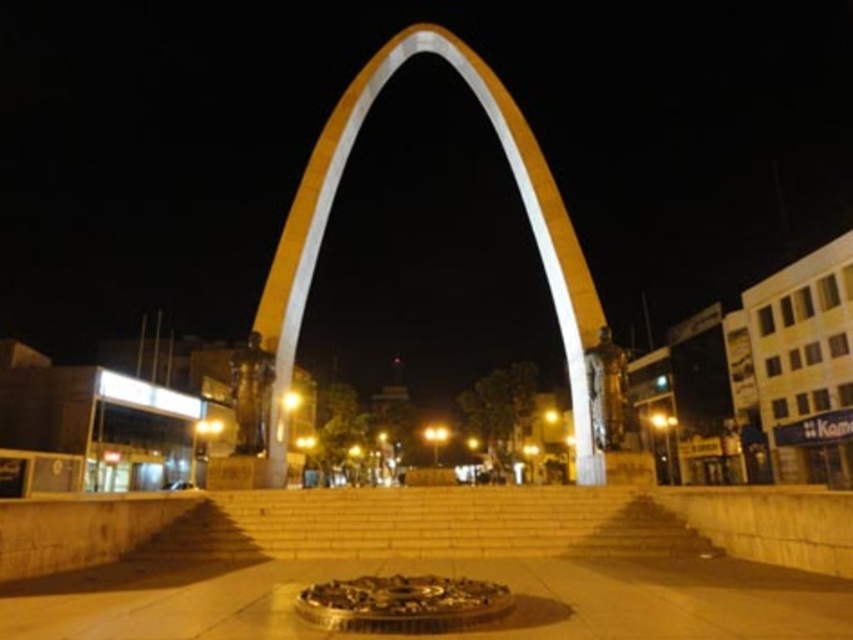
Question: Which point appears farthest from the camera in this image?

Choices:
 (A) (548, 195)
 (B) (625, 525)

Answer: (A)

Question: Among these objects, which one is nearest to the camera?

Choices:
 (A) yellow concrete arch at center
 (B) light beige stone stairs at center

Answer: (B)

Question: Does light beige stone stairs at center have a greater width compared to yellow concrete arch at center?

Choices:
 (A) yes
 (B) no

Answer: (B)

Question: Does light beige stone stairs at center have a lesser width compared to yellow concrete arch at center?

Choices:
 (A) no
 (B) yes

Answer: (B)

Question: Which of the following is the farthest from the observer?

Choices:
 (A) (611, 492)
 (B) (508, 128)

Answer: (B)

Question: Can you confirm if light beige stone stairs at center is smaller than yellow concrete arch at center?

Choices:
 (A) yes
 (B) no

Answer: (A)